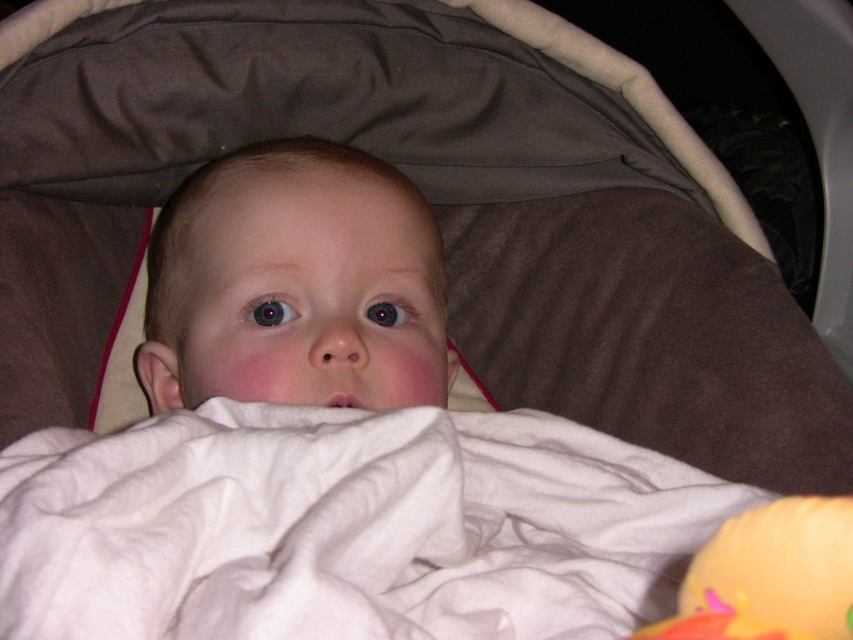
You are a photographer adjusting the lighting for a baby photo shoot. The baby is lying in a stroller covered with a white blanket at center. You need to place a small light source at point (346,528) to ensure even lighting. Is the light source placement appropriate?

The point (346,528) is where the white soft blanket at center is located, so placing the light source there would illuminate the blanket effectively, making it appropriate for even lighting during the baby photo shoot.

You are a photographer trying to capture a close up of the baby in the stroller. You need to ensure that both the white soft blanket at center and the orange rubber duck at lower right are in focus. Given that your camera can only focus on objects within a 6 inch range, will both items be in focus?

The white soft blanket at center and orange rubber duck at lower right are 6.59 inches apart from each other. Since the camera can only focus on objects within a 6 inch range, the distance between them exceeds this limit. Therefore, both items cannot be in focus simultaneously.

You are a photographer trying to capture a closeup of the baby in the stroller. The camera is positioned at a certain distance from the point marked at coordinates point (695,513). If the recommended safe distance for photographing babies is at least 24 inches to avoid startling them, is the current camera position within the safe range?

The camera is 24.20 inches away from point (695,513), which is just within the recommended safe distance of at least 24 inches. Therefore, the current camera position is within the safe range.